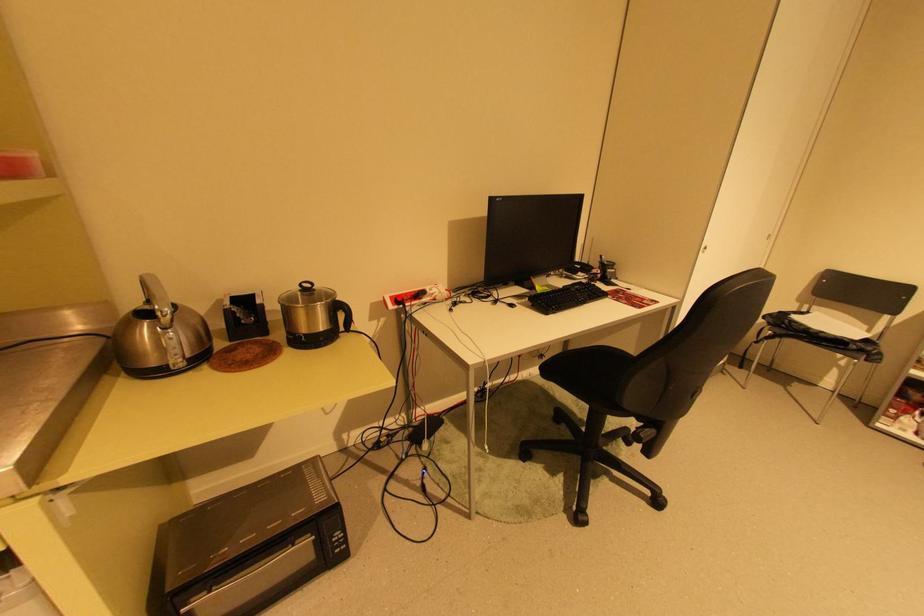
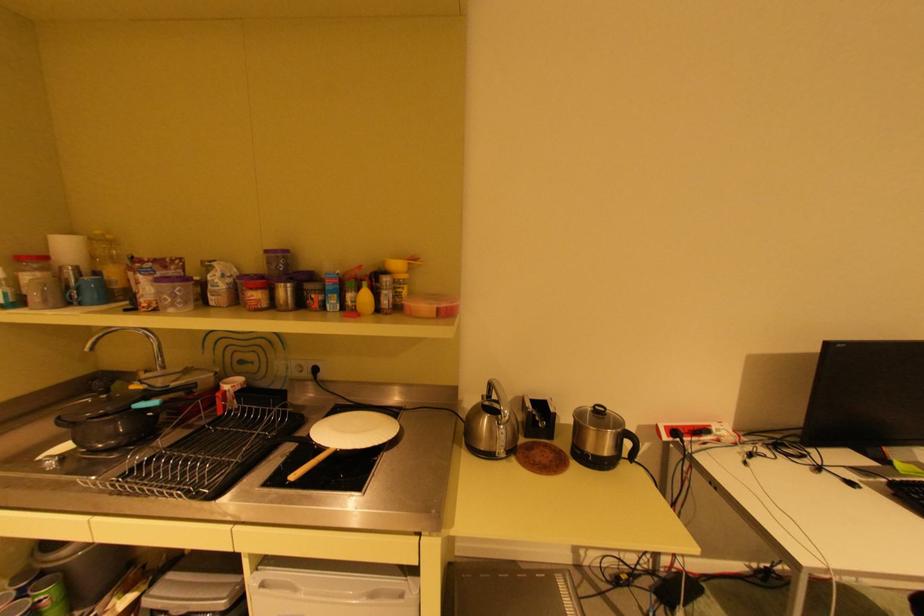
The point at the highlighted location is marked in the first image. Where is the corresponding point in the second image?

(673, 427)